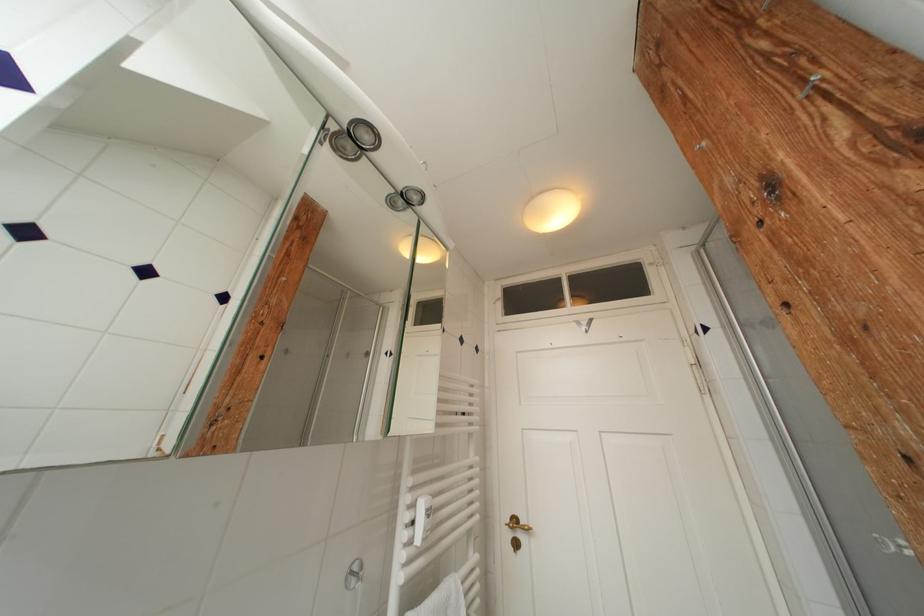
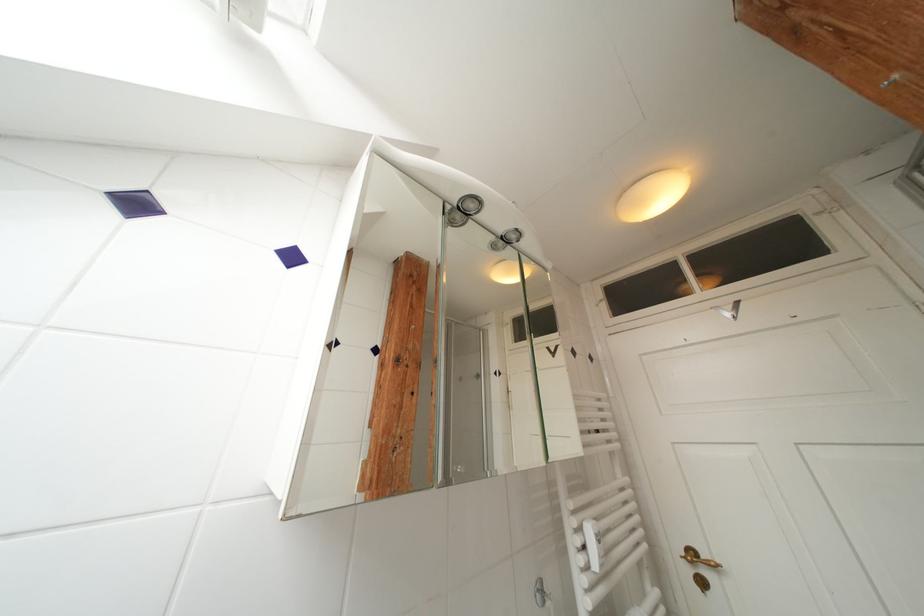
Locate, in the second image, the point that corresponds to point 361,578 in the first image.

(548, 594)